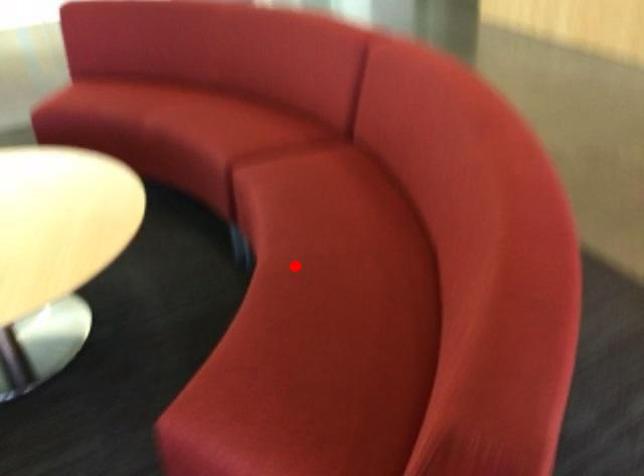
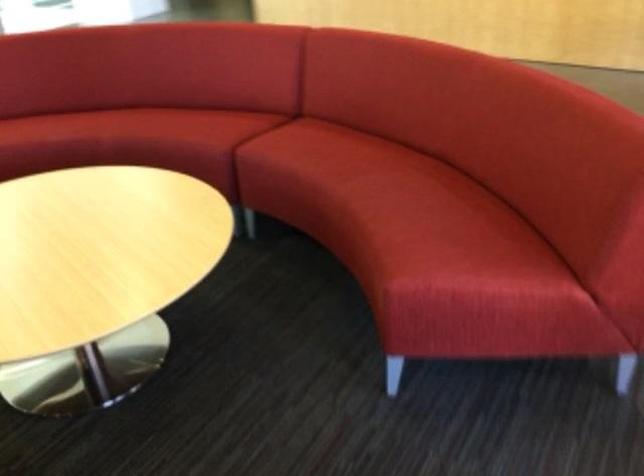
Question: I am providing you with two images of the same scene from different viewpoints. Given a red point in image1, look at the same physical point in image2. Is it:

Choices:
 (A) Closer to the viewpoint
 (B) Farther from the viewpoint

Answer: (B)